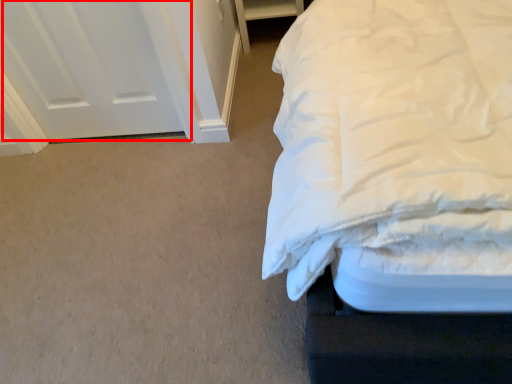
Question: From the image's perspective, where is door (annotated by the red box) located in relation to furniture in the image?

Choices:
 (A) above
 (B) below

Answer: (B)